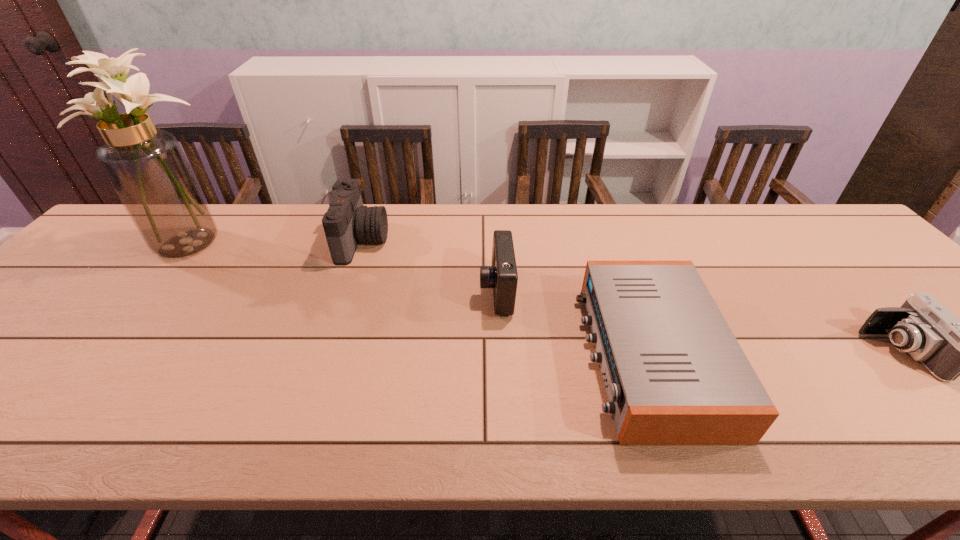
The image size is (960, 540). What are the coordinates of `free space located at the lens of the leftmost camera` in the screenshot? It's located at (468, 241).

This screenshot has height=540, width=960. What are the coordinates of `vacant area located on the front-facing side of the second nearest camera` in the screenshot? It's located at (382, 291).

Image resolution: width=960 pixels, height=540 pixels. Find the location of `vacant space located 0.120m on the front-facing side of the second nearest camera`. vacant space located 0.120m on the front-facing side of the second nearest camera is located at coordinates (433, 291).

At what (x,y) coordinates should I click in order to perform the action: click on vacant space positioned on the front-facing side of the second nearest camera. Please return your answer as a coordinate pair (x, y). Looking at the image, I should click on (413, 291).

At what (x,y) coordinates should I click in order to perform the action: click on vacant space located 0.370m at the front of the rightmost camera with an open lens cover. Please return your answer as a coordinate pair (x, y). This screenshot has width=960, height=540. Looking at the image, I should click on (702, 352).

Identify the location of free space located 0.140m at the front of the rightmost camera with an open lens cover. The image size is (960, 540). pos(805,352).

The height and width of the screenshot is (540, 960). I want to click on vacant space located at the front of the rightmost camera with an open lens cover, so click(715, 352).

This screenshot has height=540, width=960. In order to click on vacant area situated 0.220m on the front panel of the second object from right to left in this screenshot , I will do `click(487, 356)`.

The height and width of the screenshot is (540, 960). What are the coordinates of `free space located 0.240m on the front panel of the second object from right to left` in the screenshot? It's located at (478, 356).

This screenshot has height=540, width=960. Identify the location of free location located on the front panel of the second object from right to left. (473, 356).